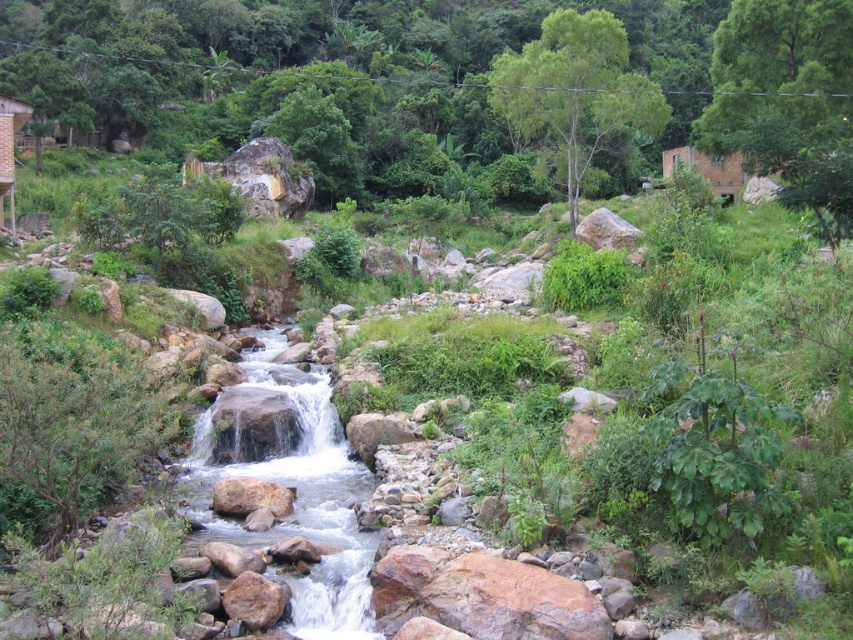
You are planning to cross the stream using a small wooden bridge that can only support objects smaller than the wooden hut at upper left. Can the smooth rock stream at center be crossed safely using this bridge?

The smooth rock stream at center has a smaller size compared to the wooden hut at upper left. Since the bridge can support objects smaller than the wooden hut at upper left, the smooth rock stream at center can be safely crossed using the bridge.

You are standing at the point labeled point (4, 99) and want to walk to the point labeled point (306, 451). Which direction should you face to move towards your destination?

You should face forward because point (306, 451) is in front of point (4, 99).

You are planning to build a small garden near the wooden hut at upper left and want to use the smooth rock stream at center as a water source. Considering their heights, will the water from the stream naturally flow towards the garden without needing pumps?

The smooth rock stream at center has a lesser height compared to wooden hut at upper left, so the water from the stream will naturally flow downward towards the garden located near the wooden hut at upper left without needing pumps.